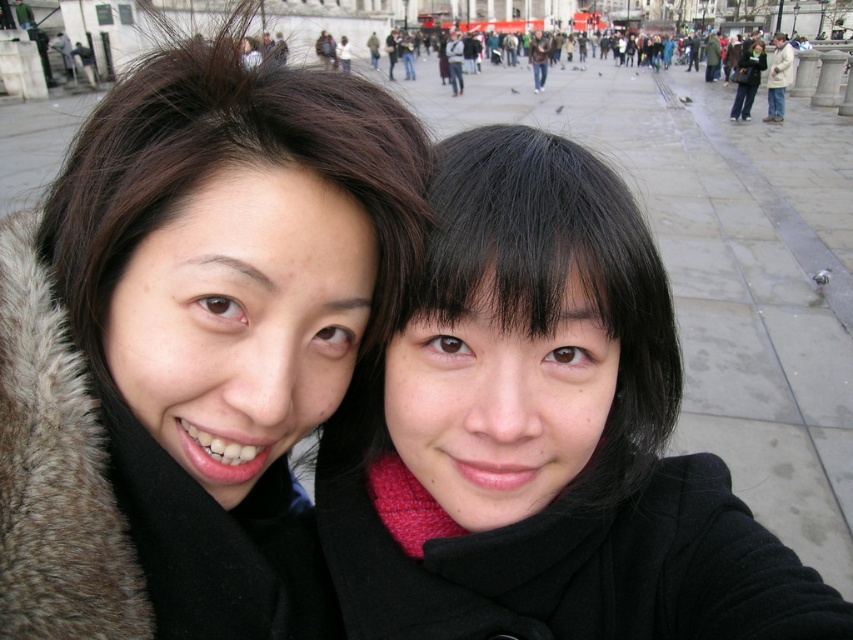
Question: Is black fur coat at upper left to the left of black matte coat at center from the viewer's perspective?

Choices:
 (A) yes
 (B) no

Answer: (A)

Question: Which point appears closest to the camera in this image?

Choices:
 (A) (396, 566)
 (B) (161, 369)

Answer: (B)

Question: From the image, what is the correct spatial relationship of black fur coat at upper left in relation to black matte coat at center?

Choices:
 (A) left
 (B) right

Answer: (A)

Question: Among these objects, which one is nearest to the camera?

Choices:
 (A) black fur coat at upper left
 (B) black matte coat at center

Answer: (A)

Question: Which object is closer to the camera taking this photo?

Choices:
 (A) black fur coat at upper left
 (B) black matte coat at center

Answer: (A)

Question: Does black fur coat at upper left come in front of black matte coat at center?

Choices:
 (A) yes
 (B) no

Answer: (A)